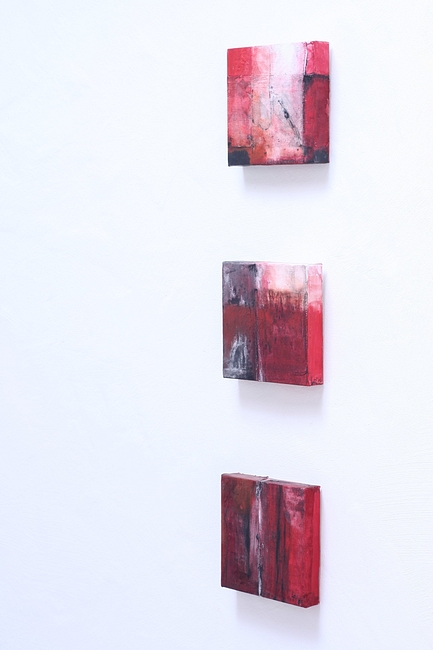
Image resolution: width=433 pixels, height=650 pixels. I want to click on wall, so click(x=123, y=470).